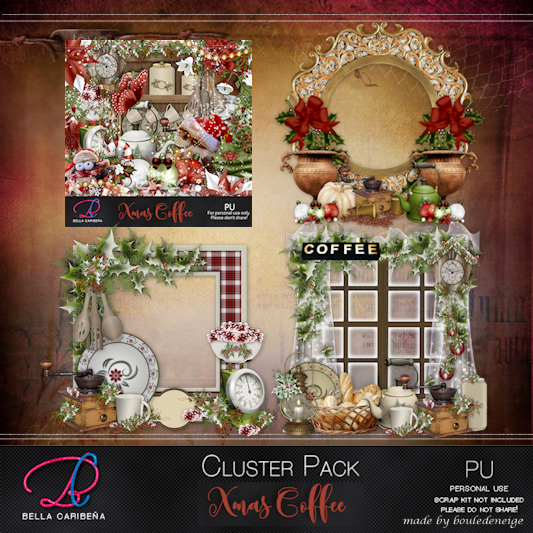
At what (x,y) coordinates should I click in order to perform the action: click on brass plant pots. Please return your answer as a coordinate pair (x, y). The height and width of the screenshot is (533, 533). Looking at the image, I should click on (316, 171), (447, 168).